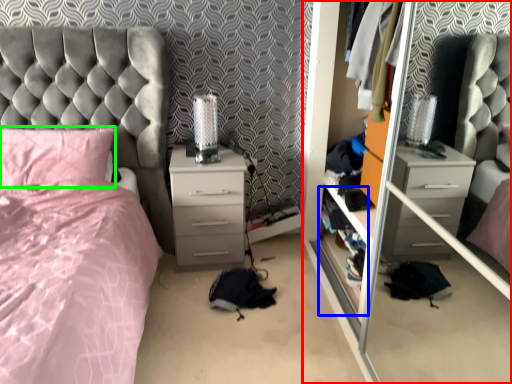
Question: Estimate the real-world distances between objects in this image. Which object is farther from glass door (highlighted by a red box), shelf (highlighted by a blue box) or pillow (highlighted by a green box)?

Choices:
 (A) shelf
 (B) pillow

Answer: (B)